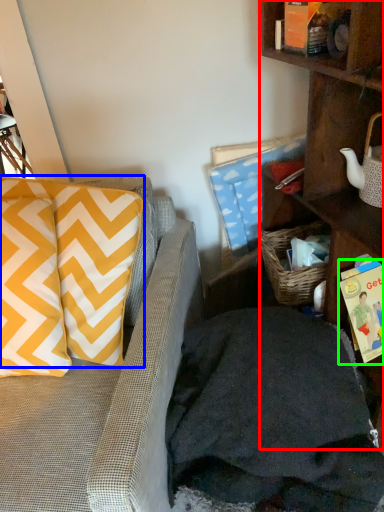
Question: Which object is positioned closest to shelf (highlighted by a red box)? Select from pillow (highlighted by a blue box) and book (highlighted by a green box).

Choices:
 (A) pillow
 (B) book

Answer: (B)